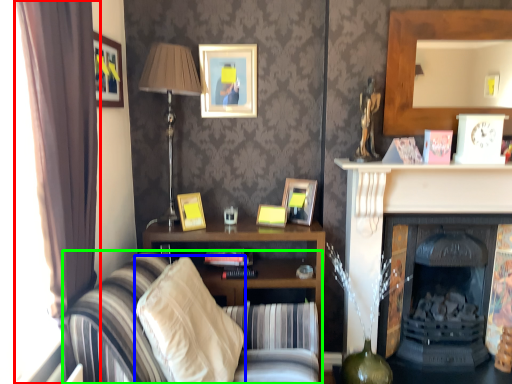
Question: Considering the real-world distances, which object is closest to curtain (highlighted by a red box)? pillow (highlighted by a blue box) or studio couch (highlighted by a green box).

Choices:
 (A) pillow
 (B) studio couch

Answer: (B)